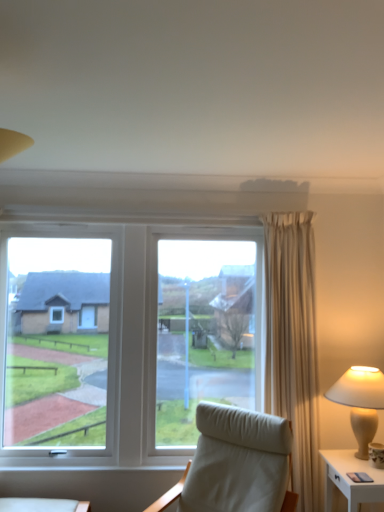
Question: From the image's perspective, relative to white fabric chair at center, is white ceramic lamp at right above or below?

Choices:
 (A) below
 (B) above

Answer: (B)

Question: Is white ceramic lamp at right to the left or to the right of white fabric chair at center in the image?

Choices:
 (A) right
 (B) left

Answer: (A)

Question: Which of these objects is positioned closest to the white ceramic lamp at right?

Choices:
 (A) white fabric chair at center
 (B) white glossy nightstand at lower right

Answer: (B)

Question: Based on their relative distances, which object is nearer to the white glossy nightstand at lower right?

Choices:
 (A) white fabric chair at center
 (B) white ceramic lamp at right

Answer: (B)